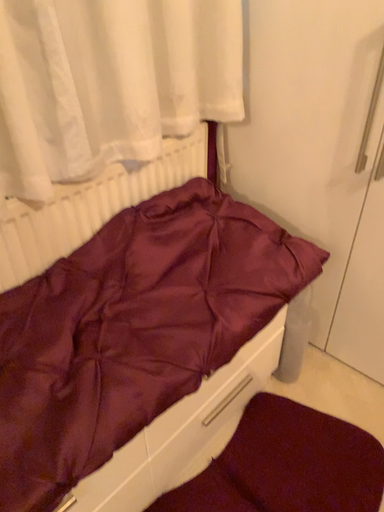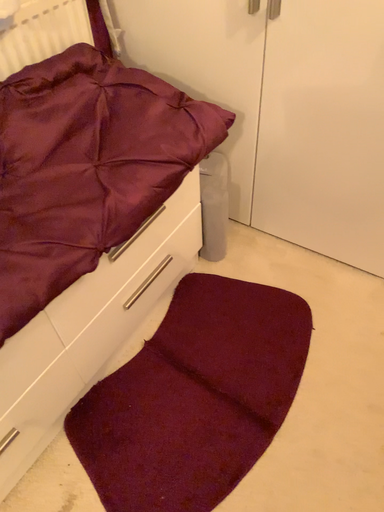
Question: Which way did the camera rotate in the video?

Choices:
 (A) rotated upward
 (B) rotated downward

Answer: (B)